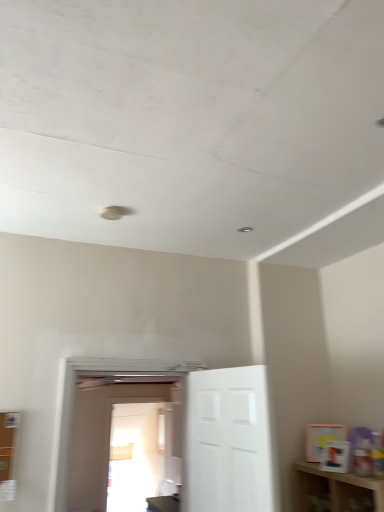
Question: Does white matte door at center, the 1th door in the right-to-left sequence, have a greater width compared to transparent glass door at center?

Choices:
 (A) no
 (B) yes

Answer: (B)

Question: Does white matte door at center, the 1th door in the right-to-left sequence, come behind transparent glass door at center?

Choices:
 (A) yes
 (B) no

Answer: (B)

Question: Is white matte door at center, the 1th door in the right-to-left sequence, oriented towards transparent glass door at center?

Choices:
 (A) no
 (B) yes

Answer: (A)

Question: Can we say white matte door at center, positioned as the second door in left-to-right order, lies outside transparent glass door at center?

Choices:
 (A) no
 (B) yes

Answer: (B)

Question: Considering the relative positions of white matte door at center, the 1th door in the right-to-left sequence, and transparent glass door at center in the image provided, is white matte door at center, the 1th door in the right-to-left sequence, to the left of transparent glass door at center from the viewer's perspective?

Choices:
 (A) no
 (B) yes

Answer: (A)

Question: Considering their positions, is transparent glass door at center located in front of or behind white matte door at center, positioned as the second door in left-to-right order?

Choices:
 (A) behind
 (B) front

Answer: (A)

Question: Which is correct: transparent glass door at center is inside white matte door at center, positioned as the second door in left-to-right order, or outside of it?

Choices:
 (A) inside
 (B) outside

Answer: (B)

Question: Does point (119, 508) appear closer or farther from the camera than point (233, 373)?

Choices:
 (A) farther
 (B) closer

Answer: (A)

Question: From the image's perspective, is transparent glass door at center above or below white matte door at center, the 1th door in the right-to-left sequence?

Choices:
 (A) below
 (B) above

Answer: (A)

Question: Which is correct: white glossy door at center, arranged as the second door when viewed from the right, is inside transparent glass door at center, or outside of it?

Choices:
 (A) outside
 (B) inside

Answer: (A)

Question: Is point (71, 453) positioned closer to the camera than point (127, 410)?

Choices:
 (A) farther
 (B) closer

Answer: (B)

Question: From the image's perspective, is white glossy door at center, arranged as the second door when viewed from the right, located above or below transparent glass door at center?

Choices:
 (A) below
 (B) above

Answer: (B)

Question: From a real-world perspective, is white glossy door at center, arranged as the second door when viewed from the right, above or below transparent glass door at center?

Choices:
 (A) above
 (B) below

Answer: (A)

Question: Considering their positions, is transparent glass door at center located in front of or behind white glossy door at center, arranged as the second door when viewed from the right?

Choices:
 (A) front
 (B) behind

Answer: (B)

Question: In terms of size, does transparent glass door at center appear bigger or smaller than white glossy door at center, the first door viewed from the left?

Choices:
 (A) big
 (B) small

Answer: (B)